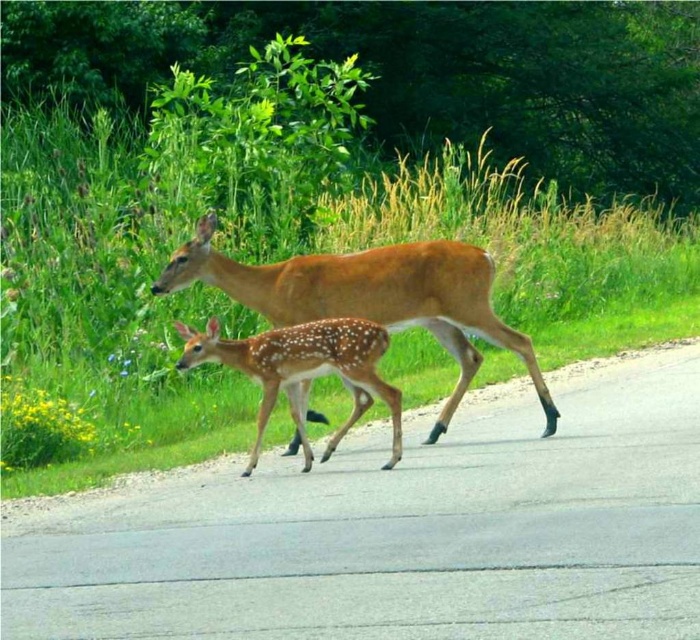
Does point (288, 288) come in front of point (251, 451)?

That is True.

At what (x,y) coordinates should I click in order to perform the action: click on brown speckled deer at center. Please return your answer as a coordinate pair (x, y). The height and width of the screenshot is (640, 700). Looking at the image, I should click on (371, 296).